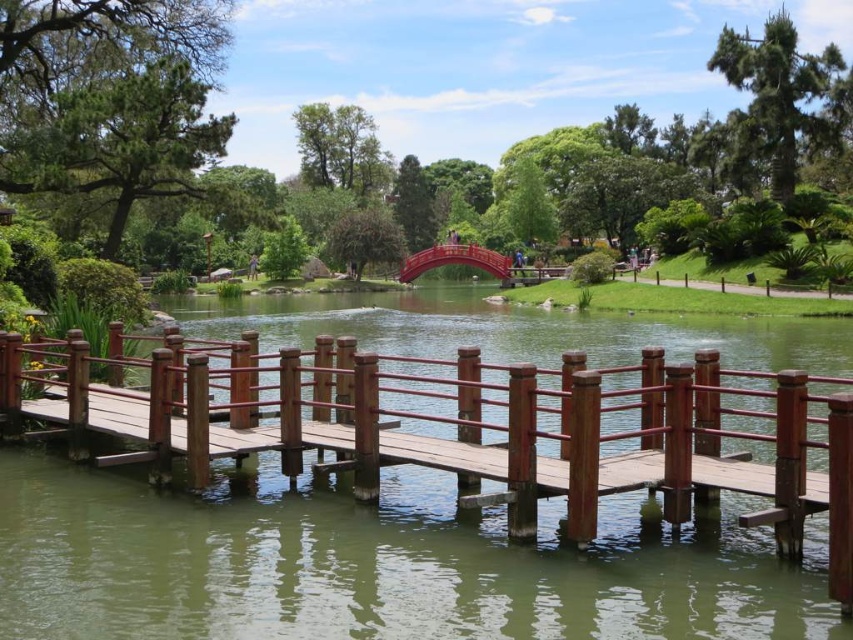
Which is more to the right, wooden dock at center or shiny red bridge at center?

Positioned to the right is shiny red bridge at center.

Measure the distance between point (171,355) and camera.

A distance of 75.42 feet exists between point (171,355) and camera.

What are the coordinates of `wooden dock at center` in the screenshot? It's located at (454, 426).